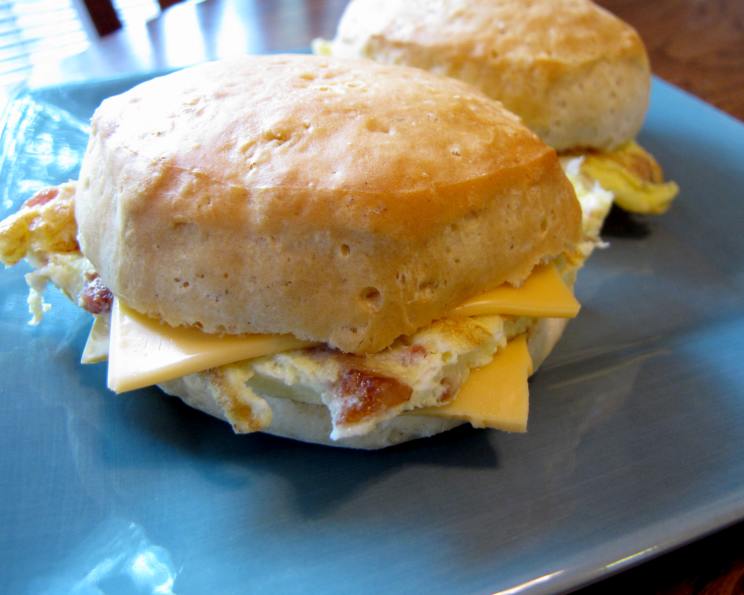
You are a GUI agent. You are given a task and a screenshot of the screen. Output one action in this format:
    pyautogui.click(x=<x>, y=<y>)
    Task: Click on the window
    This screenshot has width=744, height=595.
    Given the screenshot: What is the action you would take?
    pyautogui.click(x=22, y=33)